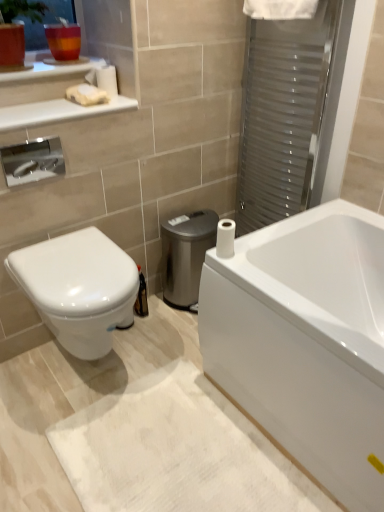
Question: Is white glossy toilet at lower left behind translucent glass cup at upper left?

Choices:
 (A) yes
 (B) no

Answer: (B)

Question: Is white glossy toilet at lower left turned away from translucent glass cup at upper left?

Choices:
 (A) no
 (B) yes

Answer: (A)

Question: Does white glossy toilet at lower left have a smaller size compared to translucent glass cup at upper left?

Choices:
 (A) yes
 (B) no

Answer: (B)

Question: Considering the relative positions of white glossy toilet at lower left and translucent glass cup at upper left in the image provided, is white glossy toilet at lower left to the left of translucent glass cup at upper left from the viewer's perspective?

Choices:
 (A) no
 (B) yes

Answer: (A)

Question: From the image's perspective, is white glossy toilet at lower left on translucent glass cup at upper left?

Choices:
 (A) no
 (B) yes

Answer: (A)

Question: Does white glossy toilet at lower left have a lesser width compared to translucent glass cup at upper left?

Choices:
 (A) no
 (B) yes

Answer: (A)

Question: Would you say transparent plastic screen door at upper right is a long distance from white matte soap at upper left?

Choices:
 (A) no
 (B) yes

Answer: (A)

Question: Is transparent plastic screen door at upper right positioned behind white matte soap at upper left?

Choices:
 (A) no
 (B) yes

Answer: (B)

Question: From the image's perspective, is transparent plastic screen door at upper right on white matte soap at upper left?

Choices:
 (A) yes
 (B) no

Answer: (B)

Question: From a real-world perspective, is transparent plastic screen door at upper right over white matte soap at upper left?

Choices:
 (A) yes
 (B) no

Answer: (B)

Question: Does transparent plastic screen door at upper right have a lesser width compared to white matte soap at upper left?

Choices:
 (A) yes
 (B) no

Answer: (A)

Question: Is the position of transparent plastic screen door at upper right less distant than that of white matte soap at upper left?

Choices:
 (A) yes
 (B) no

Answer: (B)

Question: Is translucent glass cup at upper left thinner than white matte toilet paper at upper left, the first toilet paper when ordered from back to front?

Choices:
 (A) no
 (B) yes

Answer: (A)